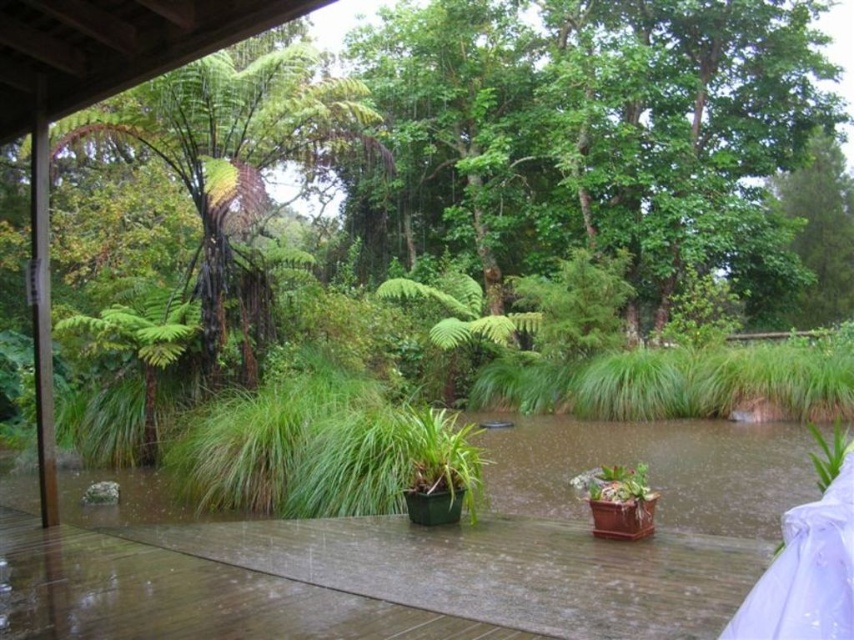
Does brown wooden deck at center have a greater width compared to green leafy tree at left?

Correct, the width of brown wooden deck at center exceeds that of green leafy tree at left.

Does point (91, 538) come in front of point (185, 90)?

Yes, point (91, 538) is in front of point (185, 90).

At what (x,y) coordinates should I click in order to perform the action: click on brown wooden deck at center. Please return your answer as a coordinate pair (x, y). The width and height of the screenshot is (854, 640). Looking at the image, I should click on (309, 595).

Can you confirm if green leafy tree at upper center is thinner than green leafy tree at left?

No.

Can you confirm if green leafy tree at upper center is smaller than green leafy tree at left?

No.

Describe the element at coordinates (603, 124) in the screenshot. The image size is (854, 640). I see `green leafy tree at upper center` at that location.

Image resolution: width=854 pixels, height=640 pixels. What are the coordinates of `green leafy tree at upper center` in the screenshot? It's located at (603, 124).

Does green leafy tree at upper center have a greater width compared to brown wooden deck at center?

Indeed, green leafy tree at upper center has a greater width compared to brown wooden deck at center.

Is green leafy tree at upper center behind brown wooden deck at center?

That is True.

Locate an element on the screen. This screenshot has width=854, height=640. green leafy tree at upper center is located at coordinates (603, 124).